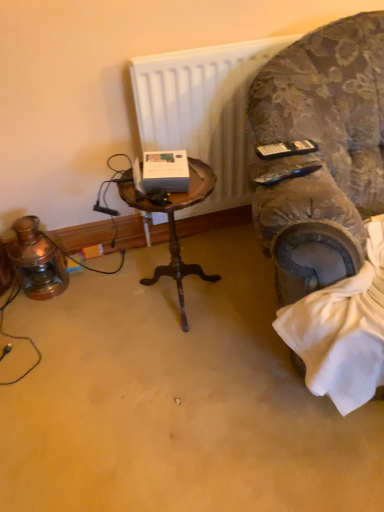
I want to click on vacant area to the left of white matte radiator at upper center, so click(x=128, y=269).